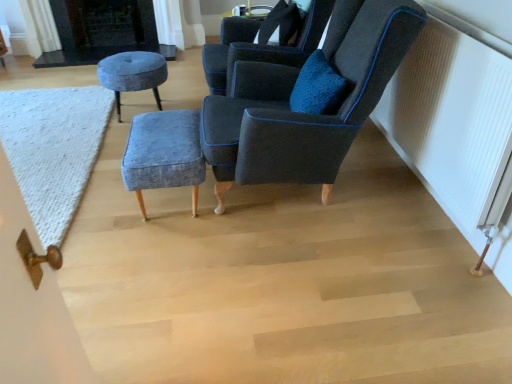
Question: Considering the positions of dark gray stone fireplace at upper left and denim fabric stool at center, placed as the first stool when sorted from bottom to top, in the image, is dark gray stone fireplace at upper left bigger or smaller than denim fabric stool at center, placed as the first stool when sorted from bottom to top,?

Choices:
 (A) small
 (B) big

Answer: (B)

Question: Is point (97, 34) closer or farther from the camera than point (139, 198)?

Choices:
 (A) farther
 (B) closer

Answer: (A)

Question: Which of these objects is positioned farthest from the white textured radiator at right?

Choices:
 (A) dark gray stone fireplace at upper left
 (B) white knitted mat at lower left
 (C) velvet blue stool at center, placed as the second stool when sorted from front to back
 (D) velvet dark blue armchair at center, positioned as the second chair in front-to-back order
 (E) velvet dark blue chair at upper right, which appears as the second chair when viewed from the back

Answer: (A)

Question: Estimate the real-world distances between objects in this image. Which object is closer to the velvet dark blue chair at upper right, which appears as the second chair when viewed from the back?

Choices:
 (A) denim fabric stool at center, placed as the first stool when sorted from bottom to top
 (B) velvet blue stool at center, the 2th stool when ordered from bottom to top
 (C) white knitted mat at lower left
 (D) white textured radiator at right
 (E) dark gray stone fireplace at upper left

Answer: (A)